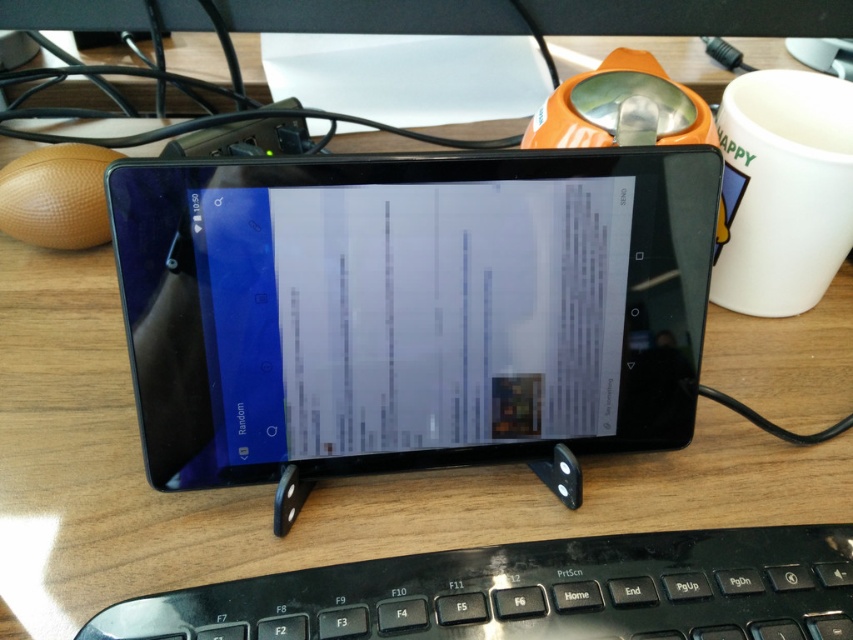
In the scene shown: Which is below, black plastic keyboard at lower center or white ceramic mug at upper right?

black plastic keyboard at lower center

At what (x,y) coordinates should I click in order to perform the action: click on black plastic keyboard at lower center. Please return your answer as a coordinate pair (x, y). The height and width of the screenshot is (640, 853). Looking at the image, I should click on (531, 593).

Between black glossy tablet at center and white ceramic mug at upper right, which one appears on the right side from the viewer's perspective?

white ceramic mug at upper right is more to the right.

Based on the photo, is black glossy tablet at center wider than white ceramic mug at upper right?

Yes, black glossy tablet at center is wider than white ceramic mug at upper right.

Between point (360, 300) and point (793, 260), which one is positioned in front?

Point (360, 300) is in front.

Locate an element on the screen. black glossy tablet at center is located at coordinates (410, 307).

Is black glossy tablet at center above black plastic keyboard at lower center?

Yes.

Is black glossy tablet at center shorter than black plastic keyboard at lower center?

No, black glossy tablet at center is not shorter than black plastic keyboard at lower center.

Locate an element on the screen. This screenshot has height=640, width=853. black glossy tablet at center is located at coordinates (410, 307).